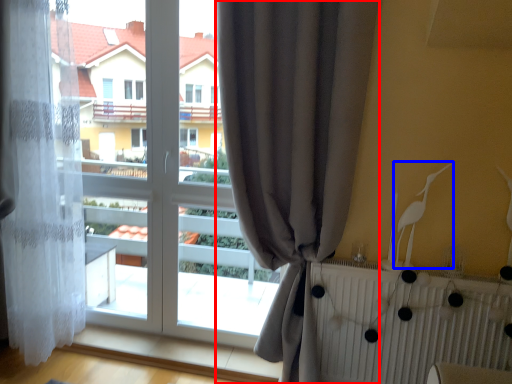
Question: Which point is closer to the camera, curtain (highlighted by a red box) or bird (highlighted by a blue box)?

Choices:
 (A) curtain
 (B) bird

Answer: (A)